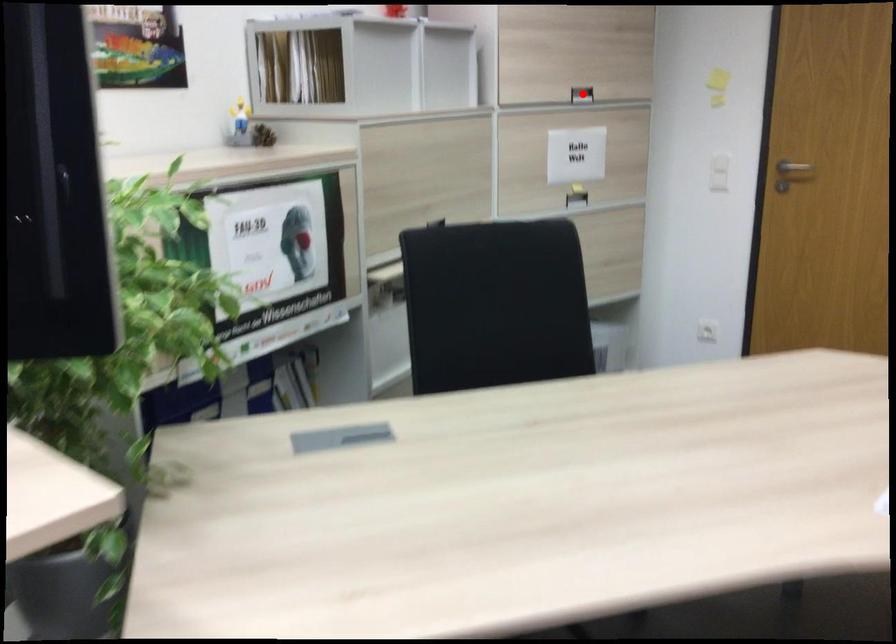
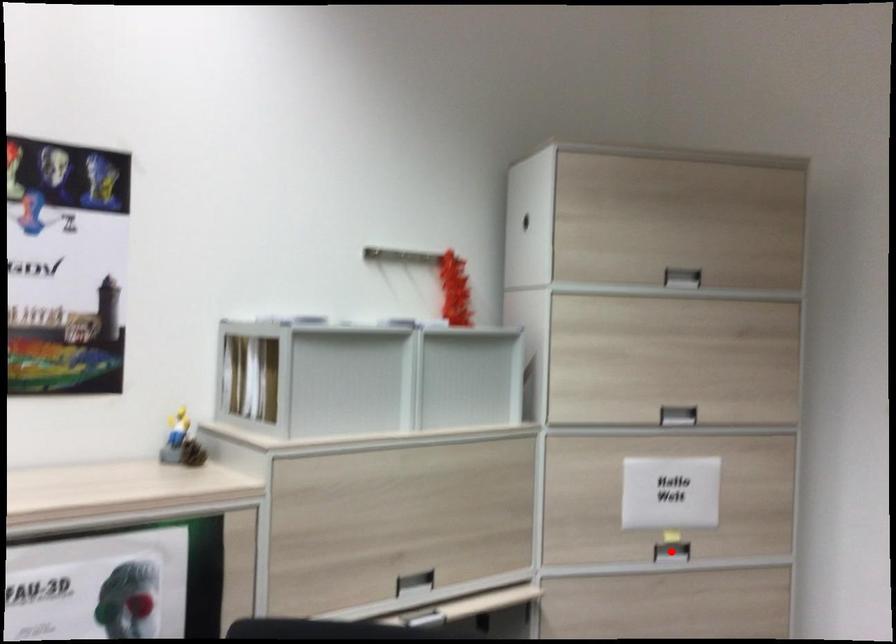
I am providing you with two images of the same scene from different viewpoints. A red point is marked on the first image and another point is marked on the second image. Is the marked point in image1 the same physical position as the marked point in image2?

No